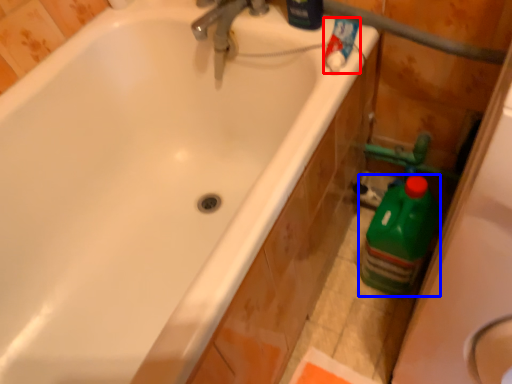
Question: Which object appears closest to the camera in this image, cleaning product (highlighted by a red box) or cleaning product (highlighted by a blue box)?

Choices:
 (A) cleaning product
 (B) cleaning product

Answer: (A)